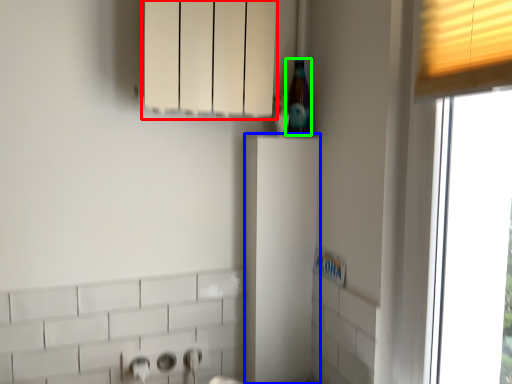
Question: Which object is positioned closest to cabinetry (highlighted by a red box)? Select from cabinetry (highlighted by a blue box) and beer bottle (highlighted by a green box).

Choices:
 (A) cabinetry
 (B) beer bottle

Answer: (B)